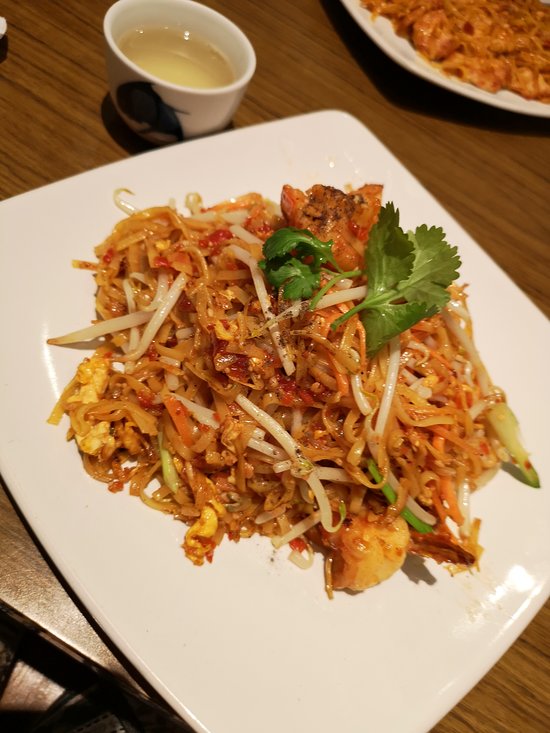
Identify the location of table. 32,133, 314,62, 497,183, 500,685, 8,574.